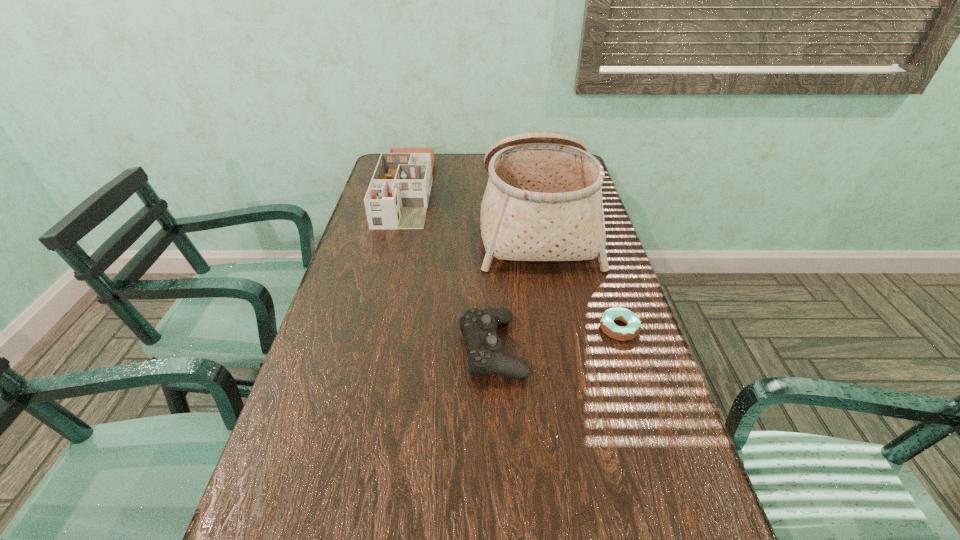
This screenshot has height=540, width=960. Find the location of `free location located 0.310m on the back of the doughnut`. free location located 0.310m on the back of the doughnut is located at coordinates (591, 242).

I want to click on object that is positioned at the far edge, so [x=398, y=195].

This screenshot has height=540, width=960. Find the location of `object that is at the left edge`. object that is at the left edge is located at coordinates (398, 195).

Where is `basket located in the right edge section of the desktop`? This screenshot has width=960, height=540. basket located in the right edge section of the desktop is located at coordinates (543, 201).

This screenshot has width=960, height=540. Identify the location of doughnut that is at the right edge. (633, 328).

This screenshot has height=540, width=960. I want to click on object at the far left corner, so [x=398, y=195].

Find the location of `vacant space at the left edge of the desktop`. vacant space at the left edge of the desktop is located at coordinates (350, 290).

Where is `vacant area at the right edge of the desktop`? The image size is (960, 540). vacant area at the right edge of the desktop is located at coordinates (601, 306).

Find the location of a particular element. The width and height of the screenshot is (960, 540). free space between the leftmost object and the control is located at coordinates (449, 269).

Locate an element on the screen. vacant space that's between the control and the shortest object is located at coordinates (556, 338).